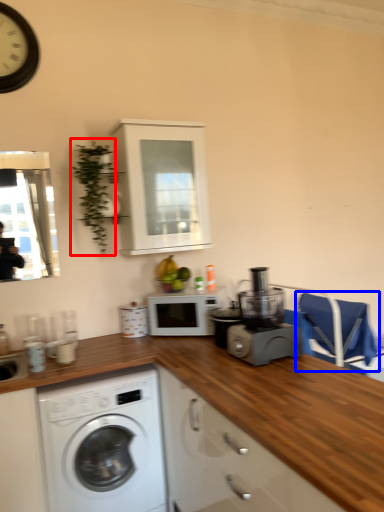
Question: Which object is closer to the camera taking this photo, plant (highlighted by a red box) or chair (highlighted by a blue box)?

Choices:
 (A) plant
 (B) chair

Answer: (A)